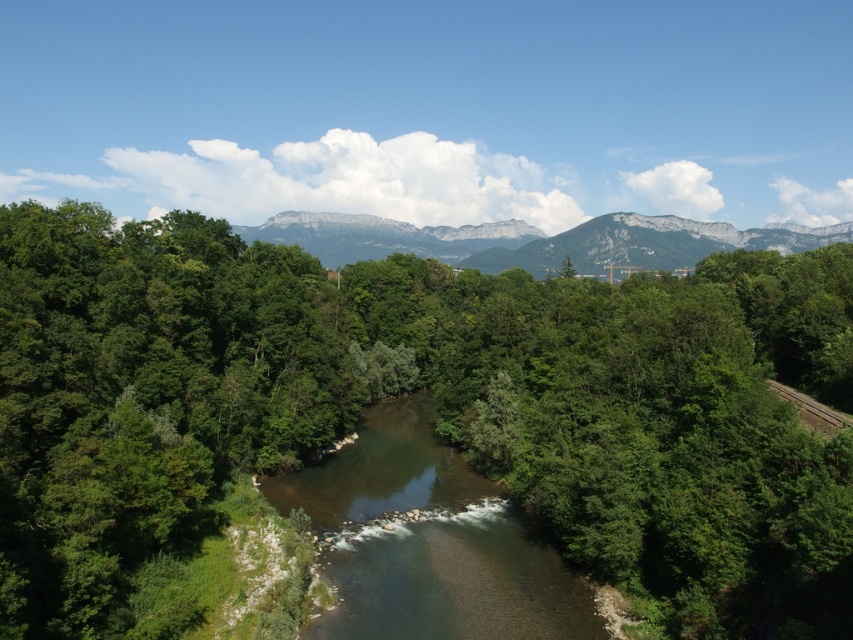
You are standing at the point marked by point (436,401) in the image. What do you see around you?

You are standing in the green leafy forest at center, as indicated by the coordinates point (436,401).